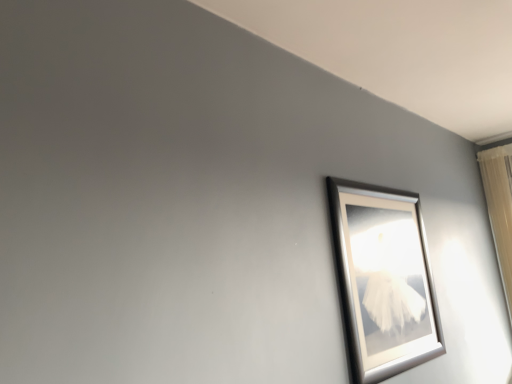
Image resolution: width=512 pixels, height=384 pixels. What do you see at coordinates (383, 280) in the screenshot?
I see `silver metallic picture frame at upper right` at bounding box center [383, 280].

Find the location of `silver metallic picture frame at upper right`. silver metallic picture frame at upper right is located at coordinates (383, 280).

Measure the distance between silver metallic picture frame at upper right and camera.

A distance of 4.47 feet exists between silver metallic picture frame at upper right and camera.

You are a GUI agent. You are given a task and a screenshot of the screen. Output one action in this format:
    pyautogui.click(x=<x>, y=<y>)
    Task: Click on the beige fabric curtain at right
    The width and height of the screenshot is (512, 384).
    Given the screenshot: What is the action you would take?
    pyautogui.click(x=499, y=208)

What do you see at coordinates (499, 208) in the screenshot?
I see `beige fabric curtain at right` at bounding box center [499, 208].

You are a GUI agent. You are given a task and a screenshot of the screen. Output one action in this format:
    pyautogui.click(x=<x>, y=<y>)
    Task: Click on the silver metallic picture frame at upper right
    
    Given the screenshot: What is the action you would take?
    pyautogui.click(x=383, y=280)

Is beige fabric curtain at right at the right side of silver metallic picture frame at upper right?

Yes.

Which object is further away from the camera taking this photo, beige fabric curtain at right or silver metallic picture frame at upper right?

Positioned behind is beige fabric curtain at right.

Looking at this image, which is more distant, (x=501, y=151) or (x=406, y=280)?

The point (x=501, y=151) is farther.

From the image's perspective, which is below, beige fabric curtain at right or silver metallic picture frame at upper right?

From the image's view, silver metallic picture frame at upper right is below.

From a real-world perspective, is beige fabric curtain at right below silver metallic picture frame at upper right?

No, from a real-world perspective, beige fabric curtain at right is not below silver metallic picture frame at upper right.

Is beige fabric curtain at right wider or thinner than silver metallic picture frame at upper right?

Clearly, beige fabric curtain at right has more width compared to silver metallic picture frame at upper right.

Which of these two, beige fabric curtain at right or silver metallic picture frame at upper right, stands taller?

beige fabric curtain at right.

Can you confirm if beige fabric curtain at right is bigger than silver metallic picture frame at upper right?

Yes, beige fabric curtain at right is bigger than silver metallic picture frame at upper right.

Is beige fabric curtain at right outside of silver metallic picture frame at upper right?

beige fabric curtain at right is positioned outside silver metallic picture frame at upper right.

Is beige fabric curtain at right next to silver metallic picture frame at upper right?

No, beige fabric curtain at right is not next to silver metallic picture frame at upper right.

Is beige fabric curtain at right turned away from silver metallic picture frame at upper right?

No, beige fabric curtain at right is not facing away from silver metallic picture frame at upper right.

Can you tell me how much beige fabric curtain at right and silver metallic picture frame at upper right differ in facing direction?

The angle between the facing direction of beige fabric curtain at right and the facing direction of silver metallic picture frame at upper right is 90.2 degrees.

The height and width of the screenshot is (384, 512). I want to click on curtain above the silver metallic picture frame at upper right (from a real-world perspective), so click(499, 208).

Considering the relative positions of silver metallic picture frame at upper right and beige fabric curtain at right in the image provided, is silver metallic picture frame at upper right to the left or to the right of beige fabric curtain at right?

silver metallic picture frame at upper right is positioned on beige fabric curtain at right's left side.

Considering their positions, is silver metallic picture frame at upper right located in front of or behind beige fabric curtain at right?

Clearly, silver metallic picture frame at upper right is in front of beige fabric curtain at right.

Which is behind, point (400, 324) or point (506, 170)?

The point (506, 170) is farther.

From the image's perspective, which one is positioned higher, silver metallic picture frame at upper right or beige fabric curtain at right?

beige fabric curtain at right, from the image's perspective.

From a real-world perspective, between silver metallic picture frame at upper right and beige fabric curtain at right, who is vertically lower?

In real-world perspective, silver metallic picture frame at upper right is lower.

In the scene shown: Does silver metallic picture frame at upper right have a lesser width compared to beige fabric curtain at right?

Yes.

Can you confirm if silver metallic picture frame at upper right is taller than beige fabric curtain at right?

Incorrect, the height of silver metallic picture frame at upper right is not larger of that of beige fabric curtain at right.

Does silver metallic picture frame at upper right have a larger size compared to beige fabric curtain at right?

No.

Is beige fabric curtain at right located within silver metallic picture frame at upper right?

No, beige fabric curtain at right is not surrounded by silver metallic picture frame at upper right.

Is the surface of silver metallic picture frame at upper right in direct contact with beige fabric curtain at right?

No, silver metallic picture frame at upper right is not touching beige fabric curtain at right.

Is silver metallic picture frame at upper right facing towards beige fabric curtain at right?

No, silver metallic picture frame at upper right is not oriented towards beige fabric curtain at right.

In the image, there is a silver metallic picture frame at upper right. Where is `curtain above it (from the image's perspective)`? The image size is (512, 384). curtain above it (from the image's perspective) is located at coordinates pyautogui.click(x=499, y=208).

I want to click on curtain above the silver metallic picture frame at upper right (from the image's perspective), so click(x=499, y=208).

Where is `picture frame that is in front of the beige fabric curtain at right`? picture frame that is in front of the beige fabric curtain at right is located at coordinates (383, 280).